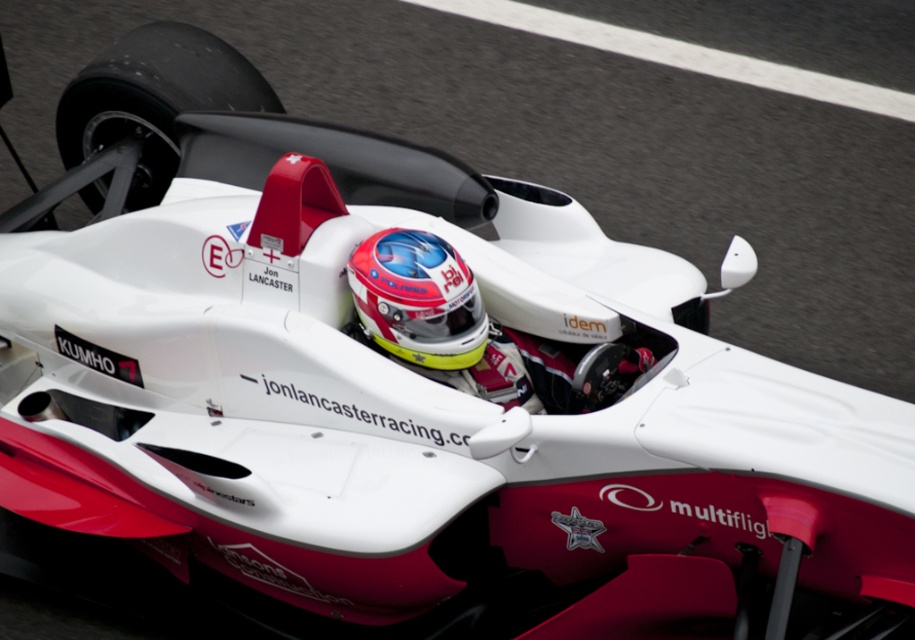
Question: Is shiny white helmet at center bigger than matte red helmet at center?

Choices:
 (A) yes
 (B) no

Answer: (A)

Question: Can you confirm if shiny white helmet at center is positioned to the right of matte red helmet at center?

Choices:
 (A) no
 (B) yes

Answer: (B)

Question: Is shiny white helmet at center further to the viewer compared to matte red helmet at center?

Choices:
 (A) no
 (B) yes

Answer: (B)

Question: Which object is farther from the camera taking this photo?

Choices:
 (A) matte red helmet at center
 (B) shiny white helmet at center

Answer: (B)

Question: Which point is farther from the camera taking this photo?

Choices:
 (A) (417, 262)
 (B) (393, 336)

Answer: (B)